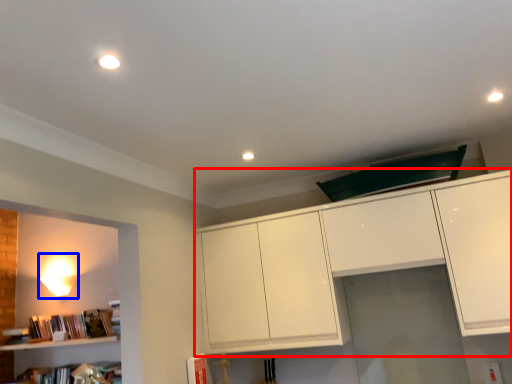
Question: Which object is closer to the camera taking this photo, cabinetry (highlighted by a red box) or lamp (highlighted by a blue box)?

Choices:
 (A) cabinetry
 (B) lamp

Answer: (A)